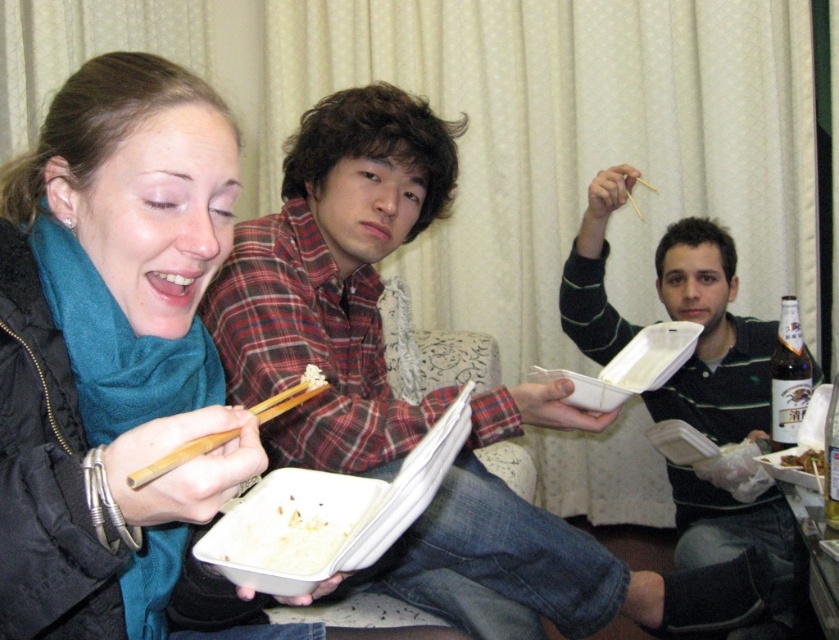
Question: Which of the following is the closest to the observer?

Choices:
 (A) (305, 400)
 (B) (757, 348)

Answer: (A)

Question: Does wooden chopsticks at left appear on the right side of wooden chopstick at upper right?

Choices:
 (A) yes
 (B) no

Answer: (B)

Question: Which object is closer to the camera taking this photo?

Choices:
 (A) plaid shirt at center
 (B) matte black jacket at left

Answer: (B)

Question: Which object is the farthest from the striped cotton shirt at center?

Choices:
 (A) green leafy vegetables at center
 (B) wooden chopsticks at left
 (C) wooden chopstick at upper right

Answer: (B)

Question: Is matte black jacket at left positioned in front of striped cotton shirt at center?

Choices:
 (A) no
 (B) yes

Answer: (B)

Question: Can you confirm if matte black jacket at left is positioned below striped cotton shirt at center?

Choices:
 (A) no
 (B) yes

Answer: (A)